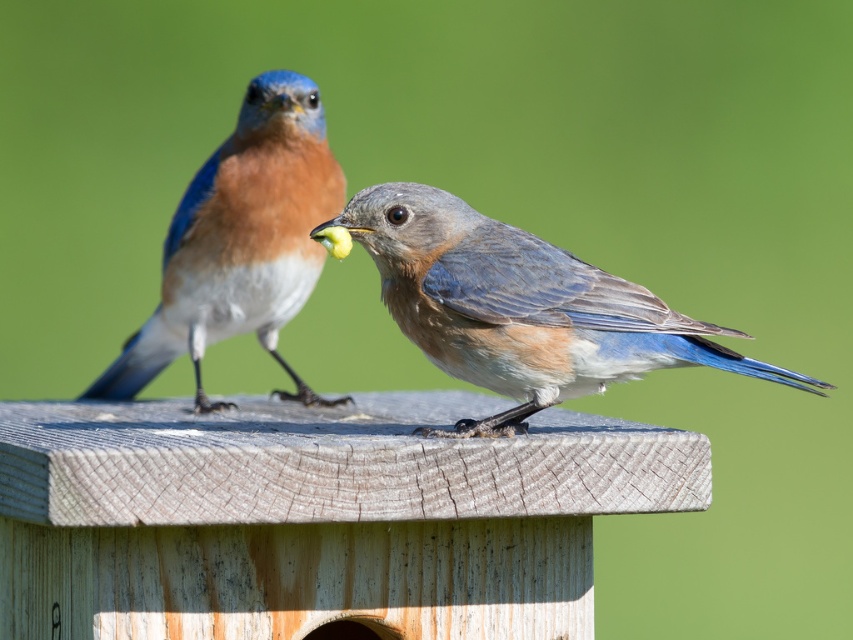
Question: Is blue-gray feathers at center above blue glossy bird at upper left?

Choices:
 (A) no
 (B) yes

Answer: (A)

Question: Among these points, which one is nearest to the camera?

Choices:
 (A) (215, 179)
 (B) (582, 394)

Answer: (B)

Question: Which object appears farthest from the camera in this image?

Choices:
 (A) blue glossy bird at upper left
 (B) blue-gray feathers at center

Answer: (A)

Question: Does blue-gray feathers at center appear under blue glossy bird at upper left?

Choices:
 (A) no
 (B) yes

Answer: (B)

Question: Is blue-gray feathers at center closer to camera compared to blue glossy bird at upper left?

Choices:
 (A) no
 (B) yes

Answer: (B)

Question: Which point is closer to the camera?

Choices:
 (A) (548, 276)
 (B) (200, 294)

Answer: (A)